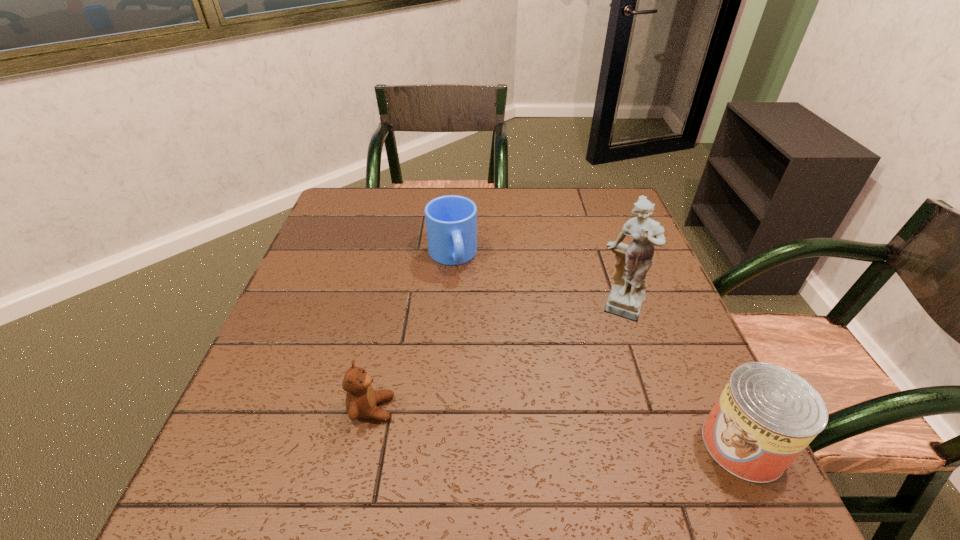
Identify the location of free space on the desktop that is between the leftmost object and the rightmost object and is positioned on the front-facing side of the second object from right to left. This screenshot has height=540, width=960. (598, 430).

Find the location of a particular element. Image resolution: width=960 pixels, height=540 pixels. free space on the desktop that is between the teddy bear and the can and is positioned on the side of the farthest object with the handle is located at coordinates (508, 422).